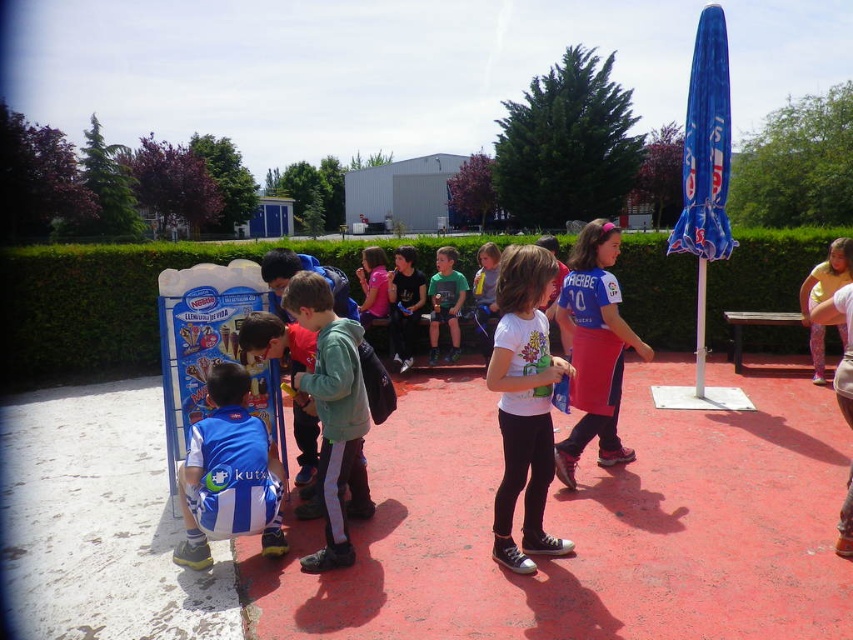
You are standing at the edge of the paved area and want to reach a specific point marked at coordinates point [115,364]. If your current position is 10 feet away from that point, how much farther do you need to walk to reach it?

The distance of point [115,364] from viewer is 30.60 feet. Since you are already 10 feet away from it, you need to walk an additional 20.60 feet to reach the point.

You are a photographer trying to capture a photo of the green matte jacket at center and the green matte shirt at center. Which one is closer to the camera?

The green matte jacket at center is positioned under the green matte shirt at center, so the green matte shirt at center is closer to the camera.